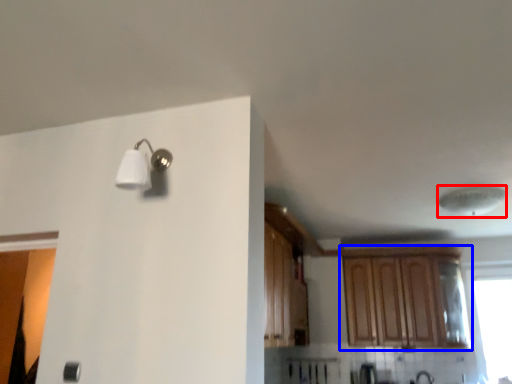
Question: Which object appears closest to the camera in this image, lamp (highlighted by a red box) or cabinetry (highlighted by a blue box)?

Choices:
 (A) lamp
 (B) cabinetry

Answer: (A)